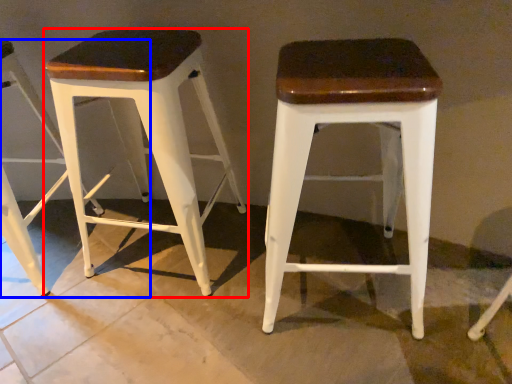
Question: Which point is closer to the camera, stool (highlighted by a red box) or stool (highlighted by a blue box)?

Choices:
 (A) stool
 (B) stool

Answer: (A)